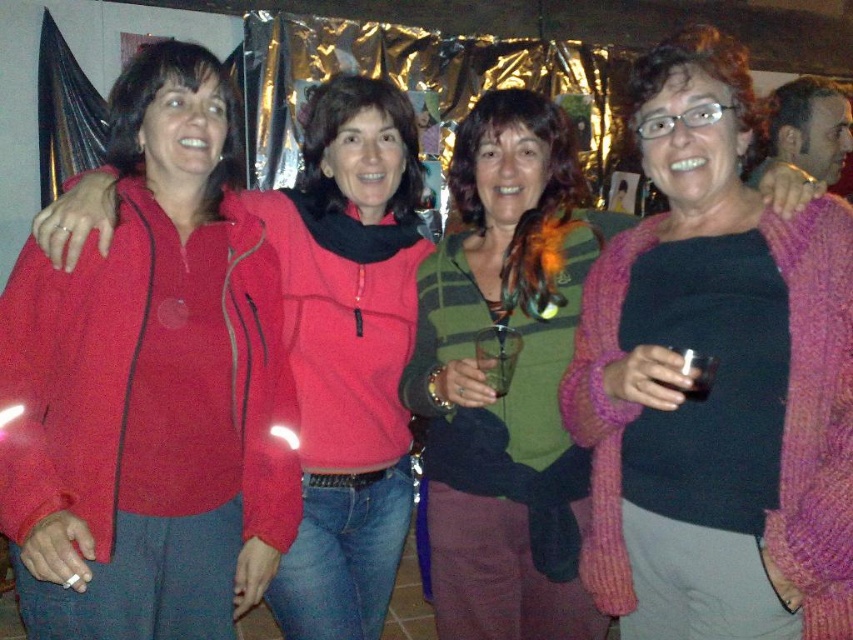
You are a photographer trying to adjust the lighting for a group photo. You notice the pink knitted sweater at center and the matte red jacket at left. Which object should you focus on if you want to highlight the taller one?

The matte red jacket at left is taller than the pink knitted sweater at center, so you should focus on the matte red jacket at left to highlight the taller one.

You are standing in front of the image and want to locate the pink knitted sweater at center. According to the coordinates given, where exactly is it positioned?

The pink knitted sweater at center is located at the 2D coordinates point (x=717, y=380).